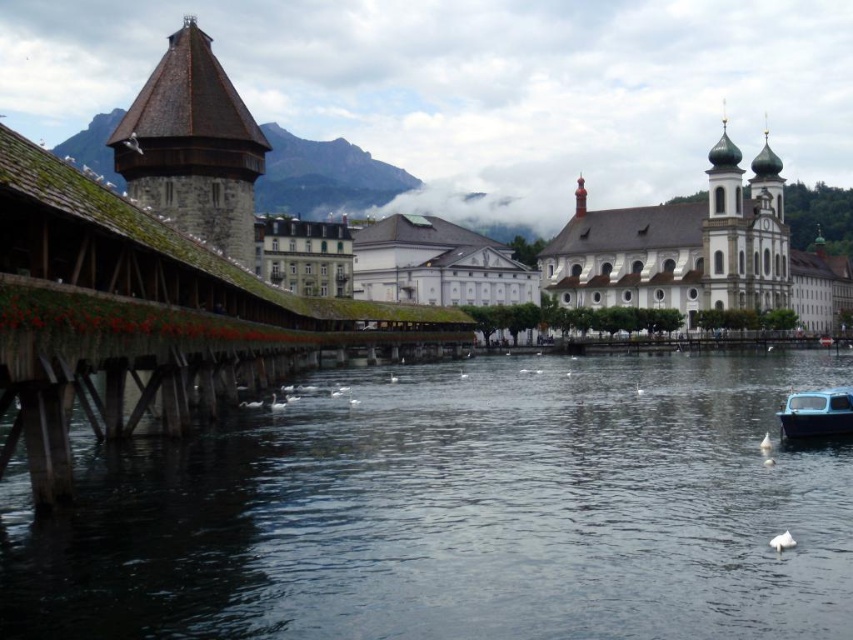
You are a tourist standing on the Chapel Bridge and want to take a photo that includes both the dark blue water at center and the brown stone tower at upper left. Which object should you position closer to the front of your photo?

You should position the dark blue water at center closer to the front of your photo because it is closer to the viewer than the brown stone tower at upper left.

You are standing at the riverside in the town and want to take a photo of the point located at coordinates (x=608, y=474). Given that your camera has a maximum focus range of 60 meters, will you be able to focus on that point?

The distance of point (x=608, y=474) from viewer is 57.99 meters, which is within the camera maximum focus range of 60 meters. Therefore, you can focus on that point.

You are a tourist standing on the Chapel Bridge and notice the dark blue water at center and the brown stone tower at upper left. Which object is positioned higher in the image?

The brown stone tower at upper left is positioned higher in the image than the dark blue water at center.